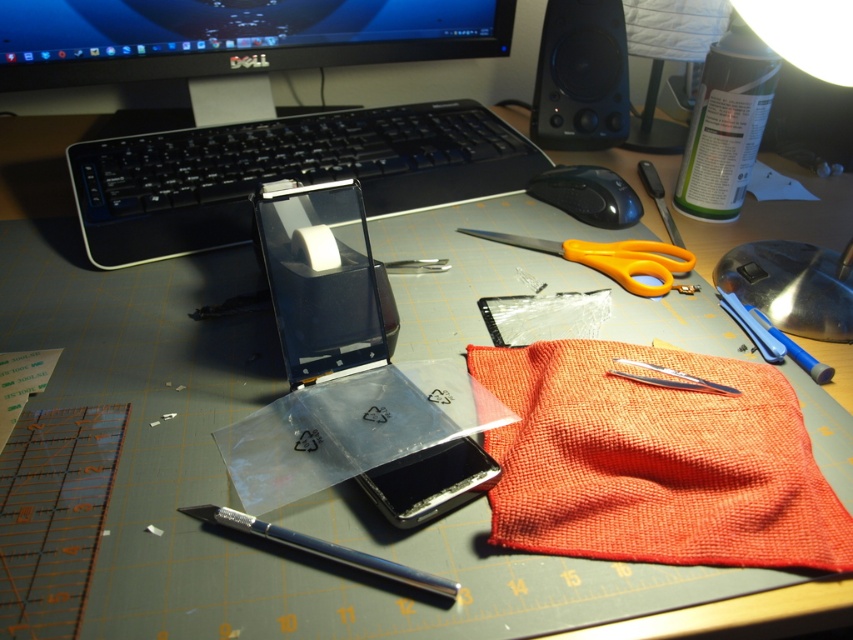
Consider the image. Which is below, transparent plastic laptop at center or orange plastic scissors at center?

transparent plastic laptop at center

Which is behind, point (430, 456) or point (670, 260)?

Point (670, 260)

Locate an element on the screen. The height and width of the screenshot is (640, 853). transparent plastic laptop at center is located at coordinates (354, 376).

Can you confirm if transparent plastic laptop at center is positioned above black glossy monitor at upper center?

No, transparent plastic laptop at center is not above black glossy monitor at upper center.

Between point (320, 387) and point (167, 104), which one is positioned in front?

Positioned in front is point (320, 387).

Is point (428, 392) more distant than point (233, 26)?

No, it is not.

At what (x,y) coordinates should I click in order to perform the action: click on transparent plastic laptop at center. Please return your answer as a coordinate pair (x, y). The height and width of the screenshot is (640, 853). Looking at the image, I should click on (354, 376).

Does black plastic speaker at upper right have a smaller size compared to orange plastic scissors at center?

Incorrect, black plastic speaker at upper right is not smaller in size than orange plastic scissors at center.

Between black plastic speaker at upper right and orange plastic scissors at center, which one appears on the left side from the viewer's perspective?

Positioned to the left is orange plastic scissors at center.

Does point (624, 65) come closer to viewer compared to point (671, 275)?

No, (624, 65) is behind (671, 275).

Where is `black plastic speaker at upper right`? The image size is (853, 640). black plastic speaker at upper right is located at coordinates (581, 76).